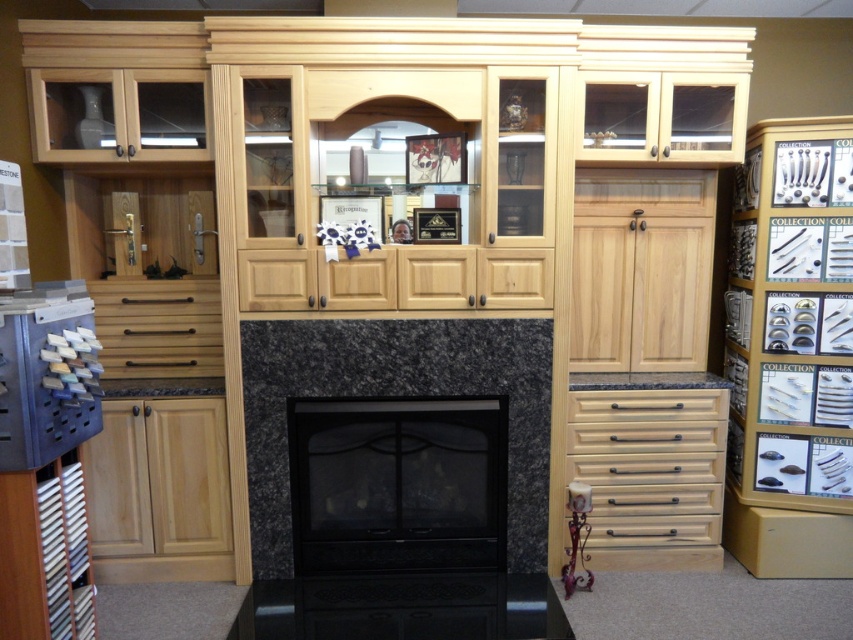
Question: Can you confirm if light wood drawer at lower right is wider than matte wood cabinet at lower left?

Choices:
 (A) yes
 (B) no

Answer: (A)

Question: Which of the following is the farthest from the observer?

Choices:
 (A) (200, 362)
 (B) (653, 252)
 (C) (7, 515)

Answer: (B)

Question: Which of the following is the closest to the observer?

Choices:
 (A) (128, 442)
 (B) (587, 236)
 (C) (701, 566)

Answer: (A)

Question: Does natural wood cabinet at lower left have a smaller size compared to matte wood drawer at center?

Choices:
 (A) yes
 (B) no

Answer: (B)

Question: Is natural wood cabinet at center smaller than natural wood cabinet at lower left?

Choices:
 (A) yes
 (B) no

Answer: (B)

Question: Which point appears closest to the camera in this image?

Choices:
 (A) click(91, 538)
 (B) click(53, 529)
 (C) click(602, 440)
 (D) click(189, 308)

Answer: (B)